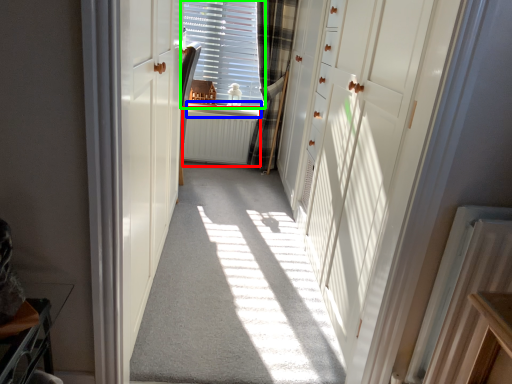
Question: Estimate the real-world distances between objects in this image. Which object is closer to radiator (highlighted by a red box), window sill (highlighted by a blue box) or window (highlighted by a green box)?

Choices:
 (A) window sill
 (B) window

Answer: (A)